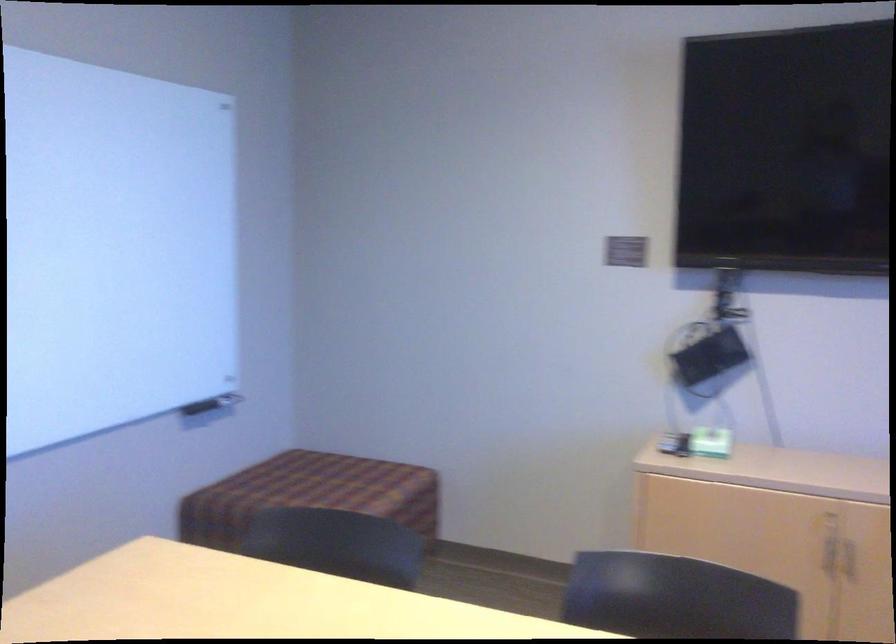
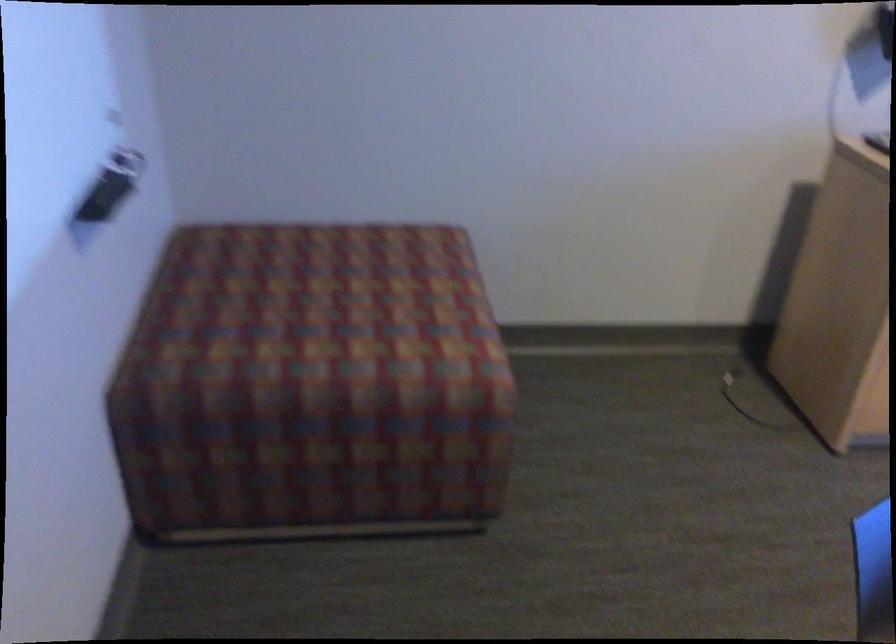
Where in the second image is the point corresponding to point (308, 483) from the first image?

(332, 301)